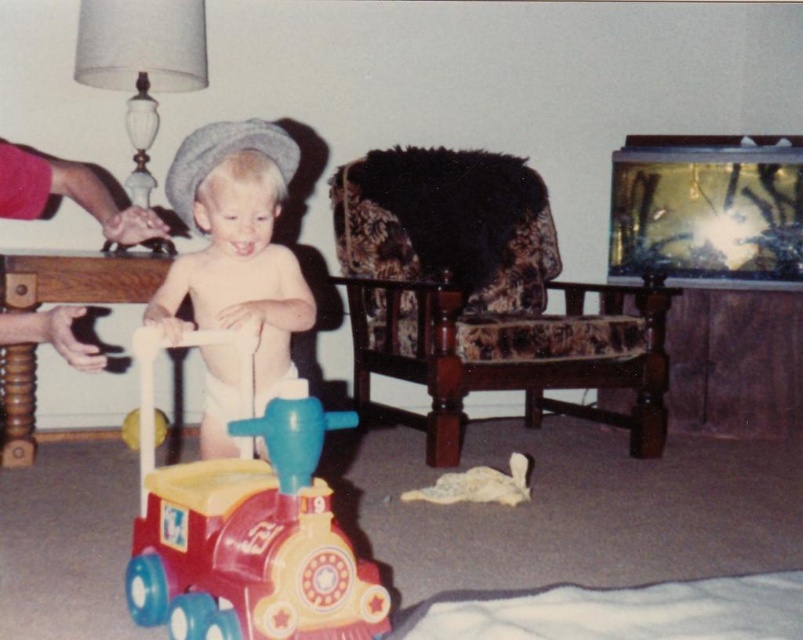
Who is positioned more to the left, plastic train at center or smooth beige baby walker at center?

smooth beige baby walker at center

Identify the location of plastic train at center. This screenshot has width=803, height=640. (247, 525).

Does point (259, 524) lie in front of point (231, 272)?

Yes, it is.

Find the location of a particular element. Image resolution: width=803 pixels, height=640 pixels. plastic train at center is located at coordinates (247, 525).